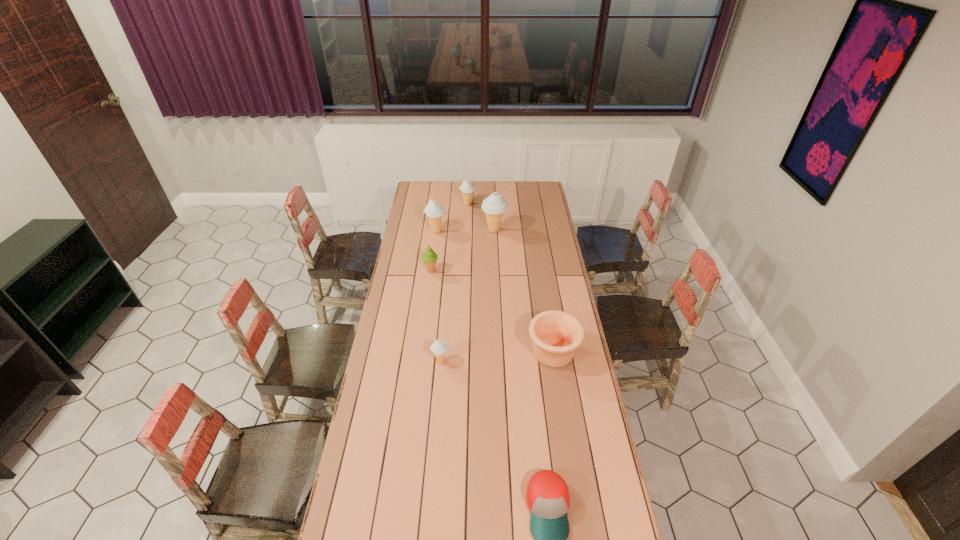
Where is `the rightmost beige icecream`? the rightmost beige icecream is located at coordinates (494, 205).

I want to click on the tallest icecream, so click(494, 205).

The height and width of the screenshot is (540, 960). What are the coordinates of `the second tallest icecream` in the screenshot? It's located at (434, 211).

Find the location of a particular element. the second biggest beige icecream is located at coordinates (434, 211).

The height and width of the screenshot is (540, 960). Find the location of `the second beige icecream from right to left`. the second beige icecream from right to left is located at coordinates (466, 188).

This screenshot has height=540, width=960. Find the location of `the fourth icecream from left to right`. the fourth icecream from left to right is located at coordinates (466, 188).

Where is `green icecream`? green icecream is located at coordinates (429, 257).

Where is `the fourth farthest object`? the fourth farthest object is located at coordinates (429, 257).

Locate an element on the screen. The image size is (960, 540). pottery is located at coordinates (556, 335).

You are a GUI agent. You are given a task and a screenshot of the screen. Output one action in this format:
    pyautogui.click(x=<x>, y=<y>)
    Task: Click on the smallest beige icecream
    The width and height of the screenshot is (960, 540).
    Given the screenshot: What is the action you would take?
    pyautogui.click(x=439, y=348)